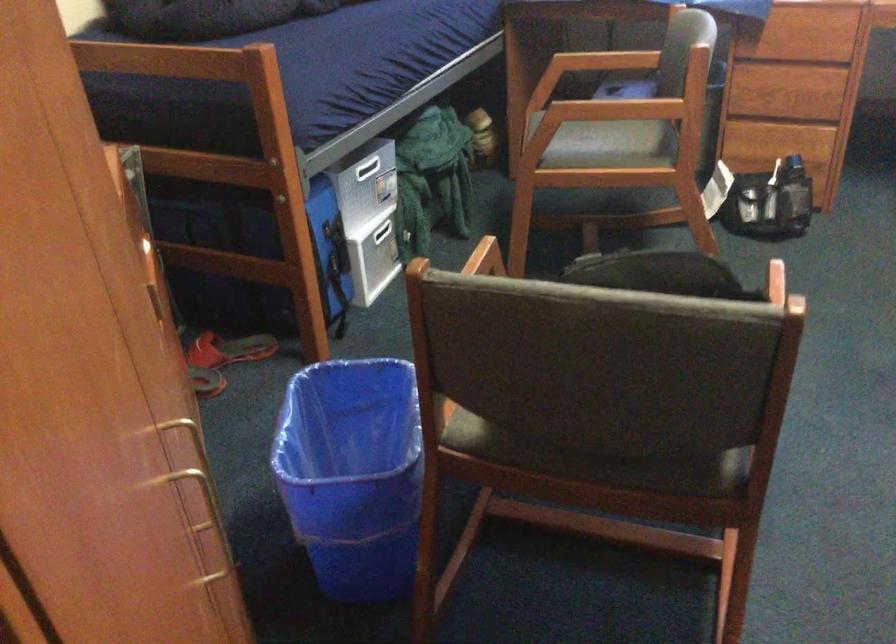
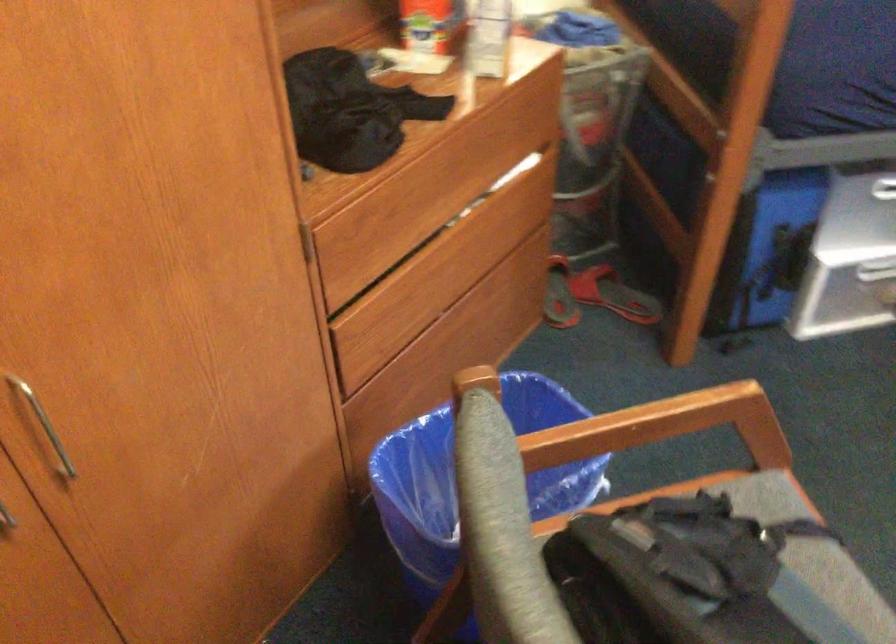
In the second image, find the point that corresponds to [455,292] in the first image.

(471, 475)